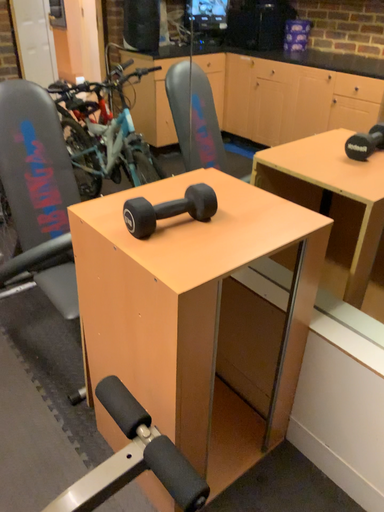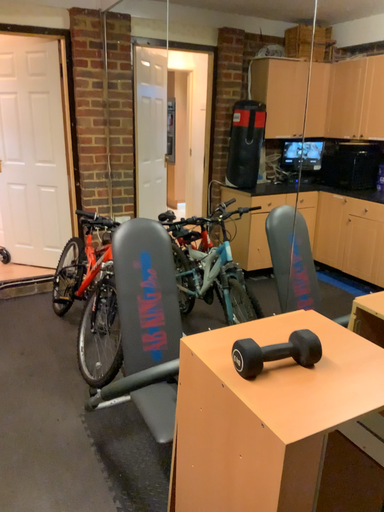
Question: How did the camera likely rotate when shooting the video?

Choices:
 (A) rotated left
 (B) rotated right

Answer: (A)